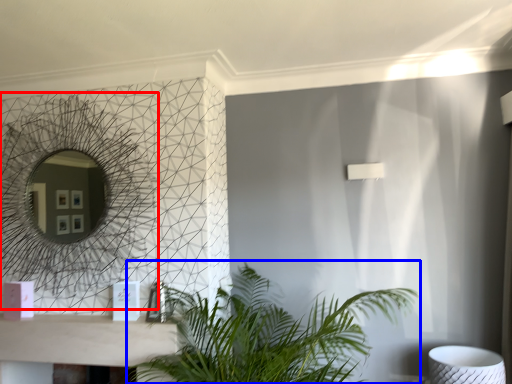
Question: Which object appears closest to the camera in this image, mirror (highlighted by a red box) or houseplant (highlighted by a blue box)?

Choices:
 (A) mirror
 (B) houseplant

Answer: (B)